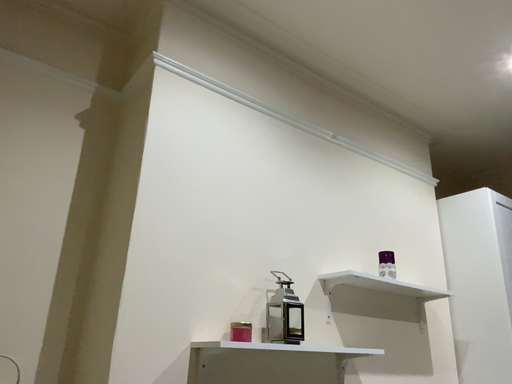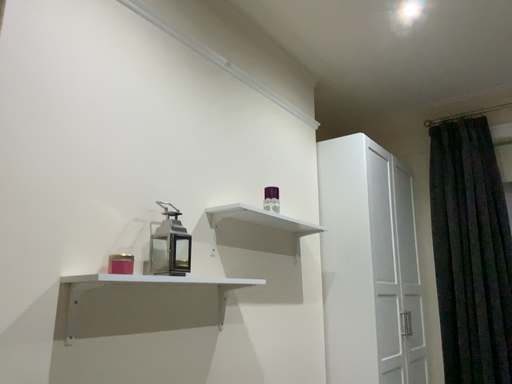
Question: Which way did the camera rotate in the video?

Choices:
 (A) rotated left
 (B) rotated right

Answer: (B)